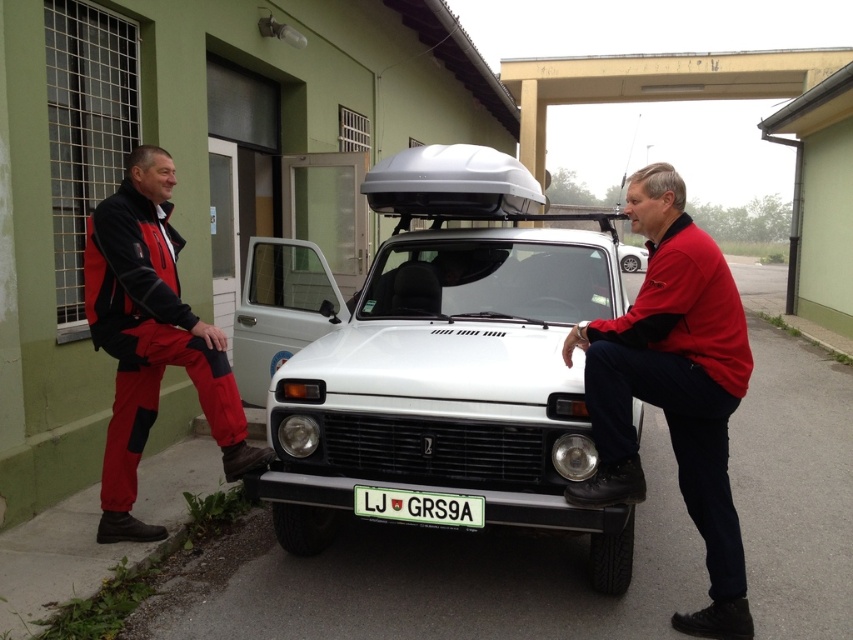
You are a delivery driver who needs to park your white matte truck at center in a parking spot that is exactly the width of the red softshell jacket at left. Can you fit your truck into the parking spot without touching the sides?

The white matte truck at center is wider than the red softshell jacket at left, so it cannot fit into a parking spot that is exactly the width of the red softshell jacket at left without touching the sides.

You are a delivery person trying to park your bike between the red softshell jacket at left and the white matte car at center. Is there enough space to fit your bike?

The red softshell jacket at left is positioned on the left side of white matte car at center, so there is space between them. Your bike should fit if the distance between them is sufficient for your bike.